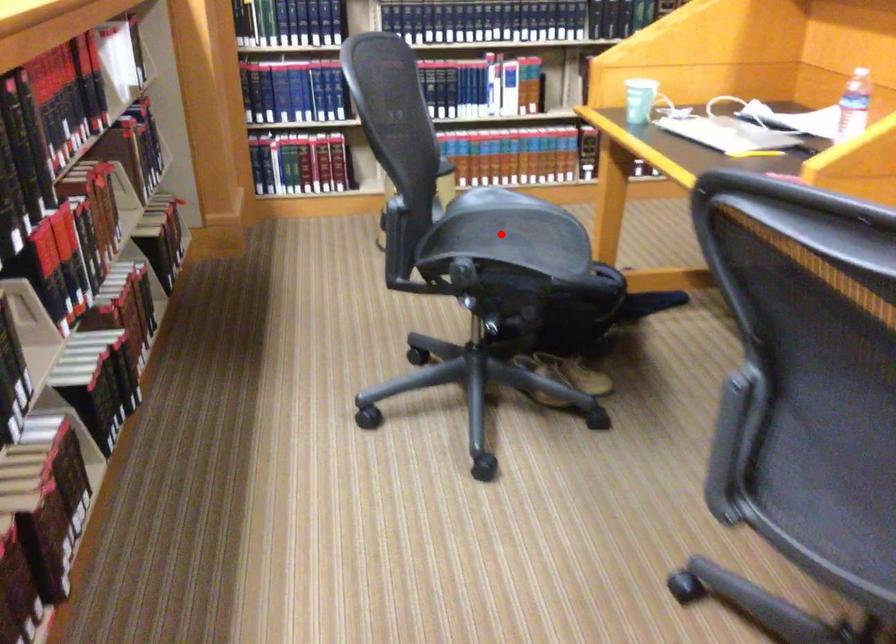
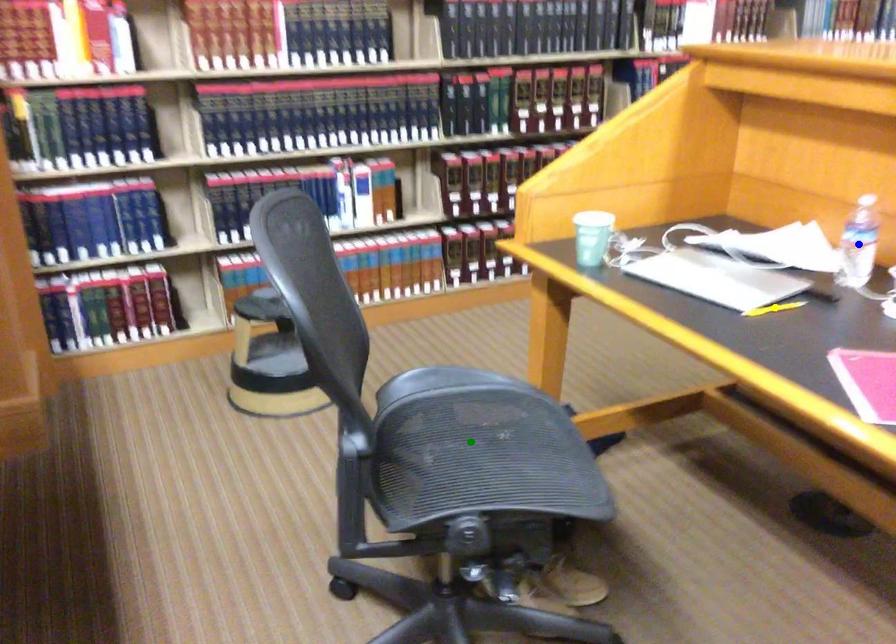
Question: I am providing you with two images of the same scene from different viewpoints. A red point is marked on the first image. You are given multiple points on the second image. In image 2, which mark is for the same physical point as the one in image 1?

Choices:
 (A) green point
 (B) blue point
 (C) yellow point

Answer: (A)